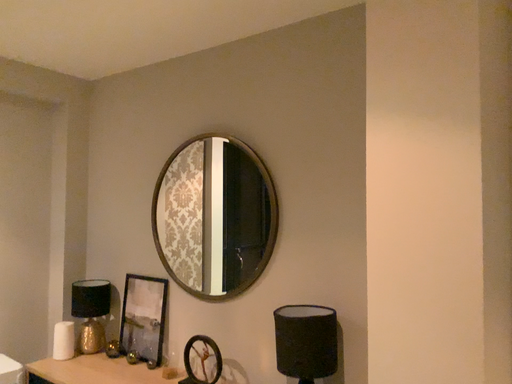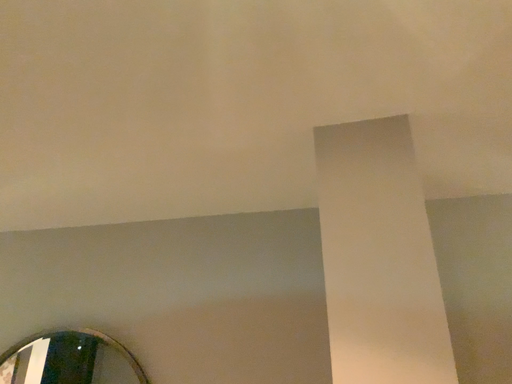
Question: Which way did the camera rotate in the video?

Choices:
 (A) rotated right
 (B) rotated left

Answer: (A)